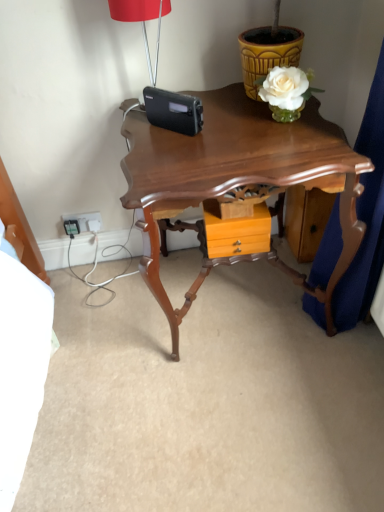
Describe the element at coordinates (237, 178) in the screenshot. I see `shiny brown wooden table at center` at that location.

Find the location of a particular element. This screenshot has width=384, height=512. yellow textured flowerpot at upper right is located at coordinates (267, 53).

Is yellow textured flowerpot at upper right at the back of white plastic electrical outlet at lower left?

white plastic electrical outlet at lower left does not have its back to yellow textured flowerpot at upper right.

Considering the relative positions of white plastic electrical outlet at lower left and yellow textured flowerpot at upper right in the image provided, is white plastic electrical outlet at lower left to the right of yellow textured flowerpot at upper right from the viewer's perspective?

Incorrect, white plastic electrical outlet at lower left is not on the right side of yellow textured flowerpot at upper right.

From the image's perspective, is white plastic electrical outlet at lower left on top of yellow textured flowerpot at upper right?

No.

From a real-world perspective, is white plastic electrical outlet at lower left located beneath yellow textured flowerpot at upper right?

Correct, in the physical world, white plastic electrical outlet at lower left is lower than yellow textured flowerpot at upper right.

From the image's perspective, is orange wood drawer at center positioned above or below shiny brown wooden table at center?

orange wood drawer at center is situated higher than shiny brown wooden table at center in the image.

Is orange wood drawer at center in front of or behind shiny brown wooden table at center in the image?

Visually, orange wood drawer at center is located behind shiny brown wooden table at center.

Is matte red lampshade at upper center touching orange wood drawer at center?

There is a gap between matte red lampshade at upper center and orange wood drawer at center.

Does matte red lampshade at upper center have a lesser width compared to orange wood drawer at center?

Indeed, matte red lampshade at upper center has a lesser width compared to orange wood drawer at center.

From a real-world perspective, is matte red lampshade at upper center over orange wood drawer at center?

Yes, from a real-world perspective, matte red lampshade at upper center is above orange wood drawer at center.

Is matte red lampshade at upper center turned away from white plastic electrical outlet at lower left?

No, matte red lampshade at upper center is not facing away from white plastic electrical outlet at lower left.

Does matte red lampshade at upper center have a greater height compared to white plastic electrical outlet at lower left?

Indeed, matte red lampshade at upper center has a greater height compared to white plastic electrical outlet at lower left.

At what (x,y) coordinates should I click in order to perform the action: click on electric outlet located on the left of matte red lampshade at upper center. Please return your answer as a coordinate pair (x, y). This screenshot has width=384, height=512. Looking at the image, I should click on (84, 221).

Which object is closer to the camera taking this photo, matte red lampshade at upper center or white plastic electrical outlet at lower left?

matte red lampshade at upper center is in front.

In terms of height, does white plastic electrical outlet at lower left look taller or shorter compared to orange wood drawer at center?

Clearly, white plastic electrical outlet at lower left is shorter compared to orange wood drawer at center.

Is white plastic electrical outlet at lower left in front of or behind orange wood drawer at center in the image?

Clearly, white plastic electrical outlet at lower left is behind orange wood drawer at center.

Would you say white plastic electrical outlet at lower left is to the left or to the right of orange wood drawer at center in the picture?

Clearly, white plastic electrical outlet at lower left is on the left of orange wood drawer at center in the image.

Looking at the image, does white plastic electrical outlet at lower left seem bigger or smaller compared to orange wood drawer at center?

Clearly, white plastic electrical outlet at lower left is smaller in size than orange wood drawer at center.

Can you confirm if orange wood drawer at center is thinner than white plastic electrical outlet at lower left?

In fact, orange wood drawer at center might be wider than white plastic electrical outlet at lower left.

Are orange wood drawer at center and white plastic electrical outlet at lower left far apart?

They are positioned close to each other.

From a real-world perspective, is orange wood drawer at center below white plastic electrical outlet at lower left?

No.

How many degrees apart are the facing directions of orange wood drawer at center and white plastic electrical outlet at lower left?

The angle between the facing direction of orange wood drawer at center and the facing direction of white plastic electrical outlet at lower left is 0.0109 degrees.

In terms of height, does white plastic electrical outlet at lower left look taller or shorter compared to matte red lampshade at upper center?

Considering their sizes, white plastic electrical outlet at lower left has less height than matte red lampshade at upper center.

Is white plastic electrical outlet at lower left not close to matte red lampshade at upper center?

That's not correct — white plastic electrical outlet at lower left is a little close to matte red lampshade at upper center.

From the image's perspective, who appears lower, white plastic electrical outlet at lower left or matte red lampshade at upper center?

white plastic electrical outlet at lower left appears lower in the image.

Locate an element on the screen. flowerpot above the white plastic electrical outlet at lower left (from a real-world perspective) is located at coordinates (267, 53).

You are a GUI agent. You are given a task and a screenshot of the screen. Output one action in this format:
    pyautogui.click(x=<x>, y=<y>)
    Task: Click on the table below the orange wood drawer at center (from the image's perspective)
    This screenshot has height=512, width=384.
    Given the screenshot: What is the action you would take?
    pyautogui.click(x=237, y=178)

Considering their positions, is shiny brown wooden table at center positioned further to orange wood drawer at center than yellow textured flowerpot at upper right?

Based on the image, yellow textured flowerpot at upper right appears to be further to orange wood drawer at center.

Considering their positions, is yellow textured flowerpot at upper right positioned further to shiny brown wooden table at center than matte red lampshade at upper center?

Among the two, matte red lampshade at upper center is located further to shiny brown wooden table at center.

From the image, which object appears to be nearer to orange wood drawer at center, yellow textured flowerpot at upper right or shiny brown wooden table at center?

shiny brown wooden table at center lies closer to orange wood drawer at center than the other object.

From the image, which object appears to be farther from matte red lampshade at upper center, orange wood drawer at center or shiny brown wooden table at center?

Based on the image, orange wood drawer at center appears to be further to matte red lampshade at upper center.

Estimate the real-world distances between objects in this image. Which object is further from white plastic electrical outlet at lower left, matte red lampshade at upper center or yellow textured flowerpot at upper right?

yellow textured flowerpot at upper right lies further to white plastic electrical outlet at lower left than the other object.

Which object lies nearer to the anchor point shiny brown wooden table at center, white plastic electrical outlet at lower left or orange wood drawer at center?

The object closer to shiny brown wooden table at center is orange wood drawer at center.

Looking at this image, which object lies further to the anchor point shiny brown wooden table at center, yellow textured flowerpot at upper right or white plastic electrical outlet at lower left?

Among the two, white plastic electrical outlet at lower left is located further to shiny brown wooden table at center.

Which object lies nearer to the anchor point matte red lampshade at upper center, orange wood drawer at center or white plastic electrical outlet at lower left?

orange wood drawer at center.

In order to click on flowerpot between shiny brown wooden table at center and white plastic electrical outlet at lower left along the z-axis in this screenshot , I will do `click(267, 53)`.

Locate an element on the screen. The image size is (384, 512). drawer between yellow textured flowerpot at upper right and shiny brown wooden table at center in the up-down direction is located at coordinates (236, 231).

Identify the location of lamp that lies between yellow textured flowerpot at upper right and orange wood drawer at center from top to bottom. (142, 21).

You are a GUI agent. You are given a task and a screenshot of the screen. Output one action in this format:
    pyautogui.click(x=<x>, y=<y>)
    Task: Click on the drawer between matte red lampshade at upper center and white plastic electrical outlet at lower left along the z-axis
    This screenshot has width=384, height=512.
    Given the screenshot: What is the action you would take?
    pyautogui.click(x=236, y=231)